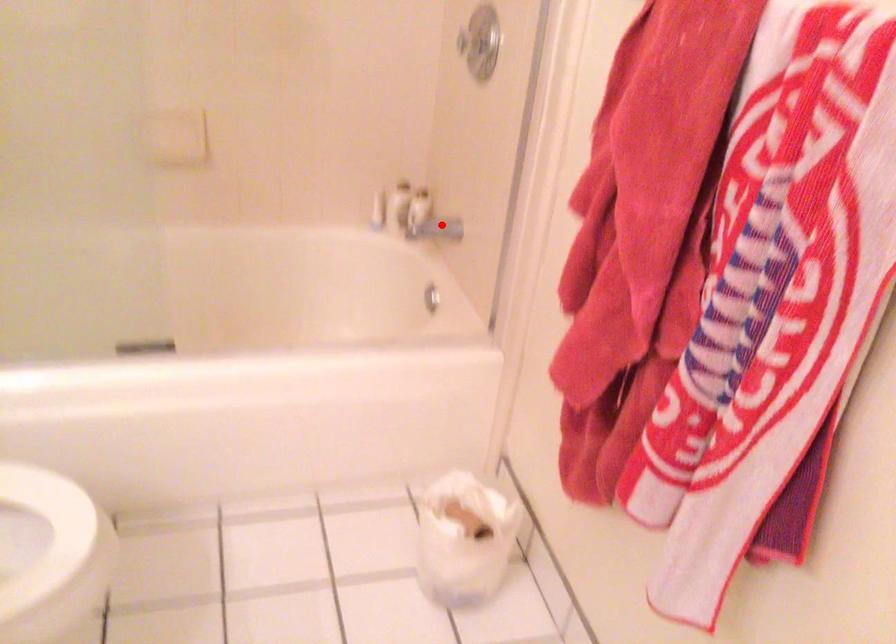
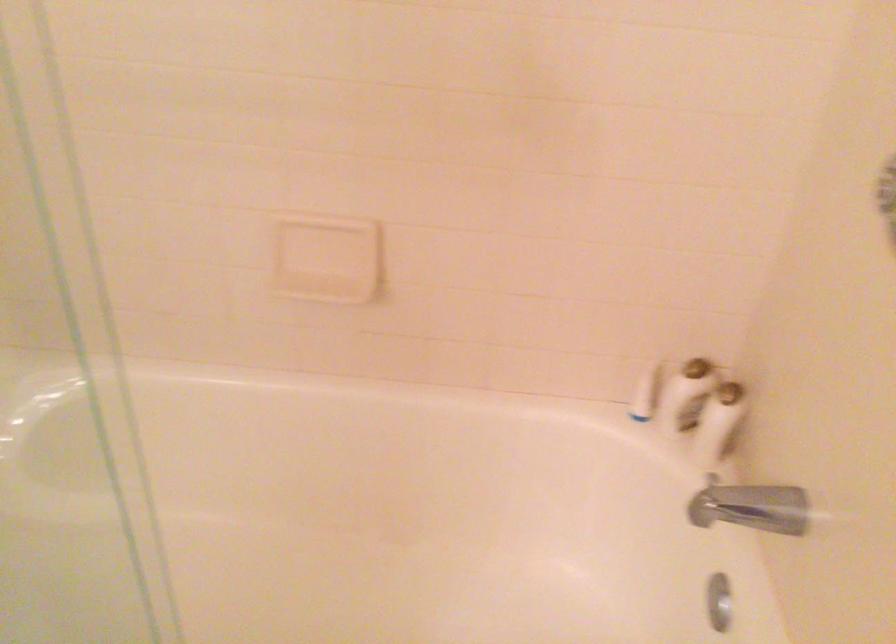
Question: I am providing you with two images of the same scene from different viewpoints. Given a red point in image1, look at the same physical point in image2. Is it:

Choices:
 (A) Closer to the viewpoint
 (B) Farther from the viewpoint

Answer: (A)